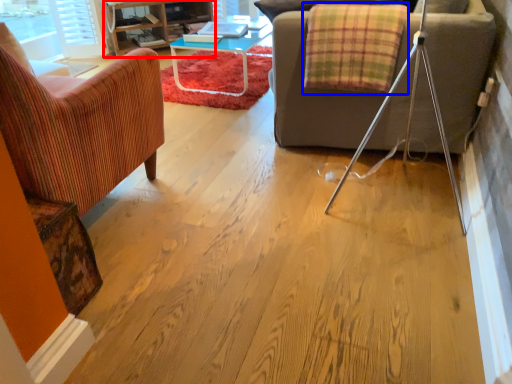
Question: Among these objects, which one is nearest to the camera, entertainment center (highlighted by a red box) or blanket (highlighted by a blue box)?

Choices:
 (A) entertainment center
 (B) blanket

Answer: (B)